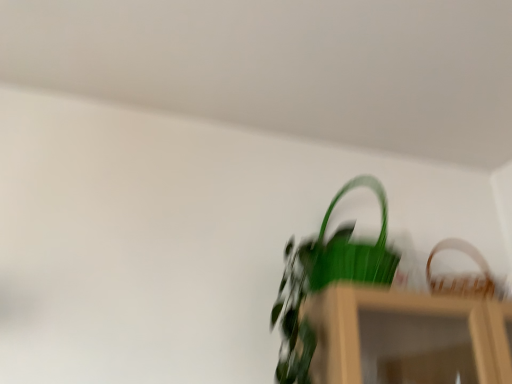
Question: Can you confirm if green matte plant at center is bigger than wooden woven basket at upper right?

Choices:
 (A) no
 (B) yes

Answer: (B)

Question: Considering the relative sizes of green matte plant at center and wooden woven basket at upper right in the image provided, is green matte plant at center wider than wooden woven basket at upper right?

Choices:
 (A) no
 (B) yes

Answer: (B)

Question: Does green matte plant at center come behind wooden woven basket at upper right?

Choices:
 (A) yes
 (B) no

Answer: (B)

Question: From the image's perspective, is green matte plant at center under wooden woven basket at upper right?

Choices:
 (A) yes
 (B) no

Answer: (B)

Question: Is green matte plant at center shorter than wooden woven basket at upper right?

Choices:
 (A) no
 (B) yes

Answer: (A)

Question: Considering the relative sizes of green matte plant at center and wooden woven basket at upper right in the image provided, is green matte plant at center smaller than wooden woven basket at upper right?

Choices:
 (A) no
 (B) yes

Answer: (A)

Question: Can you confirm if wooden woven basket at upper right is wider than green matte plant at center?

Choices:
 (A) yes
 (B) no

Answer: (B)

Question: Is green matte plant at center completely or partially inside wooden woven basket at upper right?

Choices:
 (A) yes
 (B) no

Answer: (B)

Question: From the image's perspective, is wooden woven basket at upper right above green matte plant at center?

Choices:
 (A) yes
 (B) no

Answer: (B)

Question: Does wooden woven basket at upper right appear on the left side of green matte plant at center?

Choices:
 (A) yes
 (B) no

Answer: (B)

Question: Is wooden woven basket at upper right further to camera compared to green matte plant at center?

Choices:
 (A) no
 (B) yes

Answer: (B)

Question: Does wooden woven basket at upper right come in front of green matte plant at center?

Choices:
 (A) yes
 (B) no

Answer: (B)

Question: Is green matte plant at center taller or shorter than wooden woven basket at upper right?

Choices:
 (A) tall
 (B) short

Answer: (A)